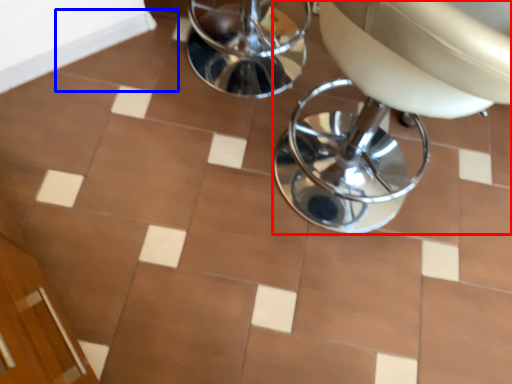
Question: Which object is further to the camera taking this photo, chair (highlighted by a red box) or ceramic tile (highlighted by a blue box)?

Choices:
 (A) chair
 (B) ceramic tile

Answer: (B)